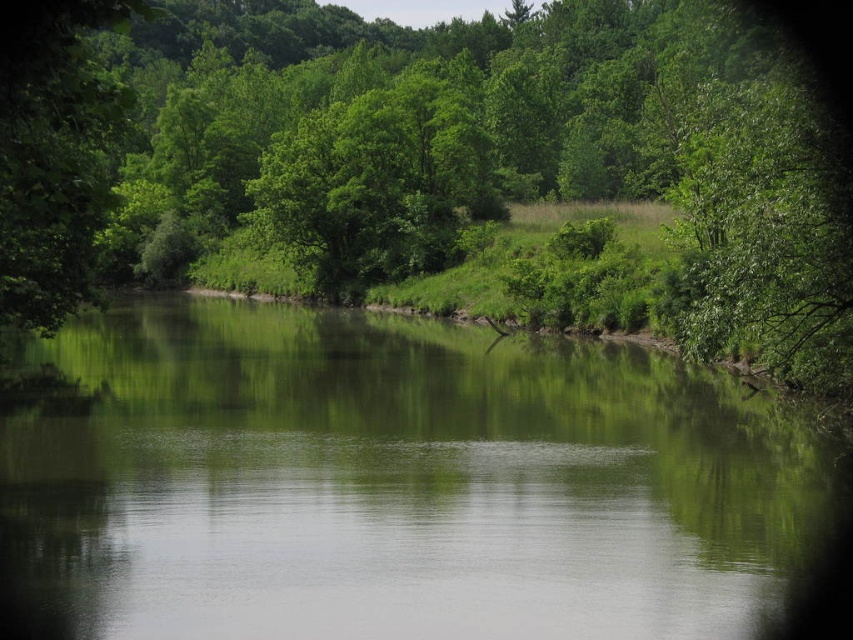
You are standing at the edge of the water in the serene natural landscape. You notice two points marked on the ground ahead of you. The first point is at coordinate point (108, 96) and the second is at point (38, 97). Which point is closer to you?

Point (38, 97) is closer to you because it is less further to the viewer than point (108, 96).

You are standing at the water edge and want to find the tallest tree between the green leafy tree at center and the green leafy tree at left. Which one should you look at?

The green leafy tree at center is taller than the green leafy tree at left, so you should look at the green leafy tree at center.

You are standing at the edge of the water and notice the green reflective water at center and the green leafy tree at center. Which object is closer to the ground?

The green reflective water at center is closer to the ground because it is positioned below the green leafy tree at center.